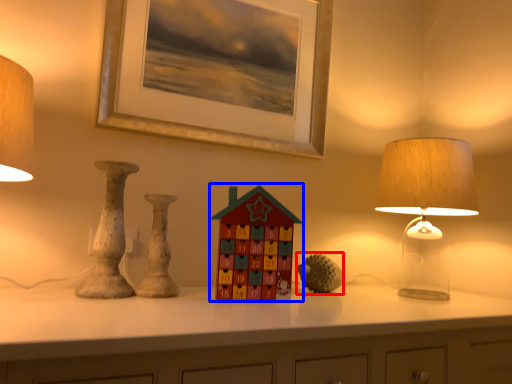
Question: Which object appears farthest to the camera in this image, toy (highlighted by a red box) or toy (highlighted by a blue box)?

Choices:
 (A) toy
 (B) toy

Answer: (A)